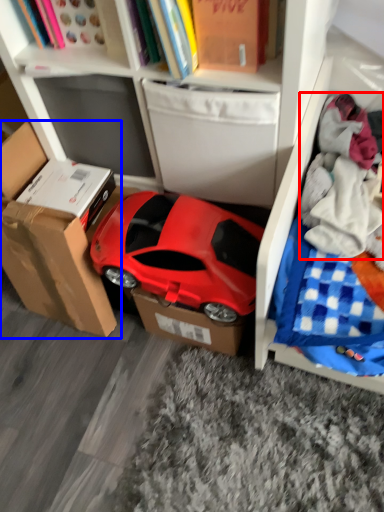
Question: Which object appears closest to the camera in this image, clothing (highlighted by a red box) or cardboard box (highlighted by a blue box)?

Choices:
 (A) clothing
 (B) cardboard box

Answer: (A)